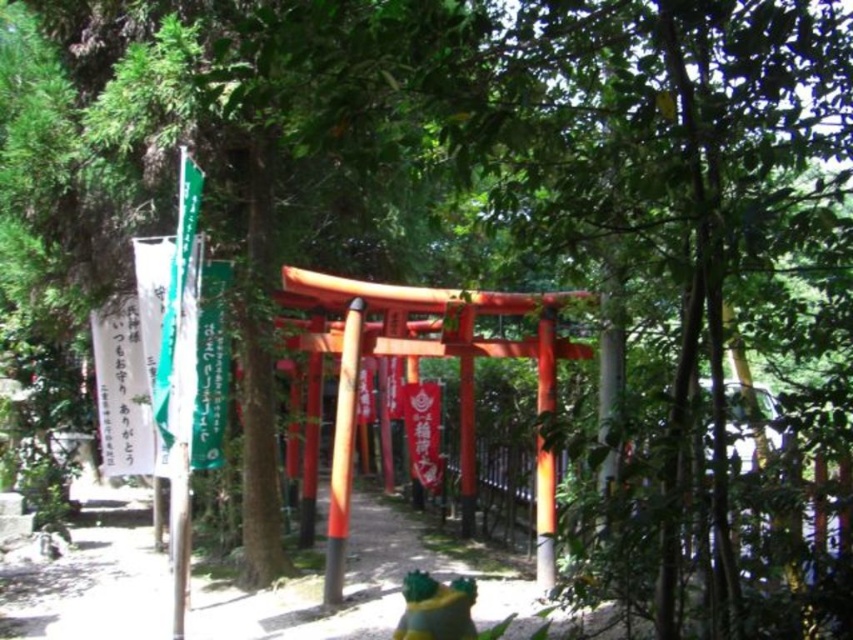
Question: Among these points, which one is farthest from the camera?

Choices:
 (A) (351, 346)
 (B) (540, 592)

Answer: (B)

Question: Does orange glossy pole at center appear on the left side of glossy wood pole at center?

Choices:
 (A) yes
 (B) no

Answer: (A)

Question: Among these points, which one is farthest from the camera?

Choices:
 (A) (329, 509)
 (B) (537, 500)

Answer: (B)

Question: Which point appears farthest from the camera in this image?

Choices:
 (A) (547, 480)
 (B) (341, 474)

Answer: (A)

Question: Does orange glossy pole at center have a greater width compared to glossy wood pole at center?

Choices:
 (A) no
 (B) yes

Answer: (B)

Question: Can you confirm if orange glossy pole at center is positioned above glossy wood pole at center?

Choices:
 (A) yes
 (B) no

Answer: (A)